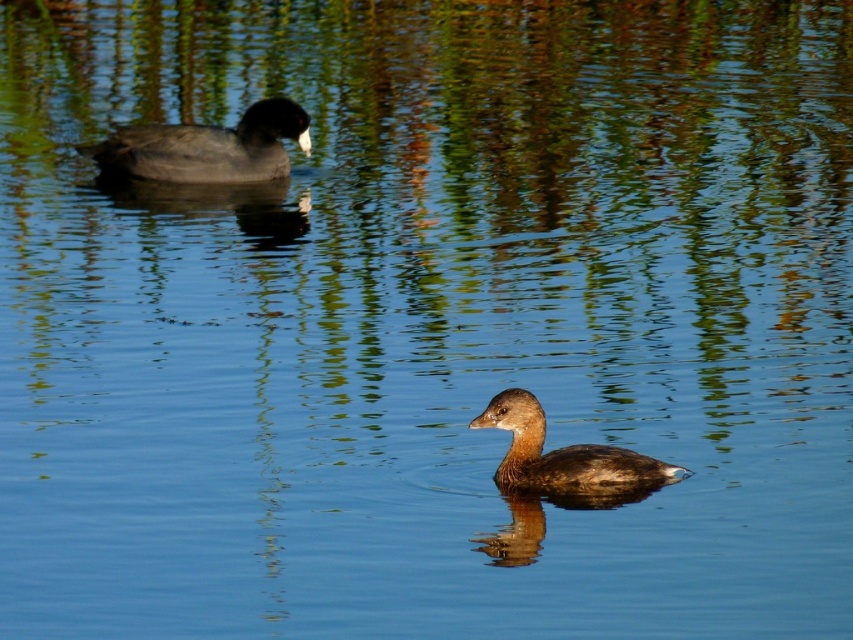
Which is more to the left, dark gray matte duck at left or brown matte duck at center?

dark gray matte duck at left is more to the left.

Between dark gray matte duck at left and brown matte duck at center, which one is positioned lower?

Positioned lower is brown matte duck at center.

Which is in front, point (213, 148) or point (529, 467)?

Point (529, 467)

This screenshot has height=640, width=853. In order to click on dark gray matte duck at left in this screenshot , I will do `click(207, 147)`.